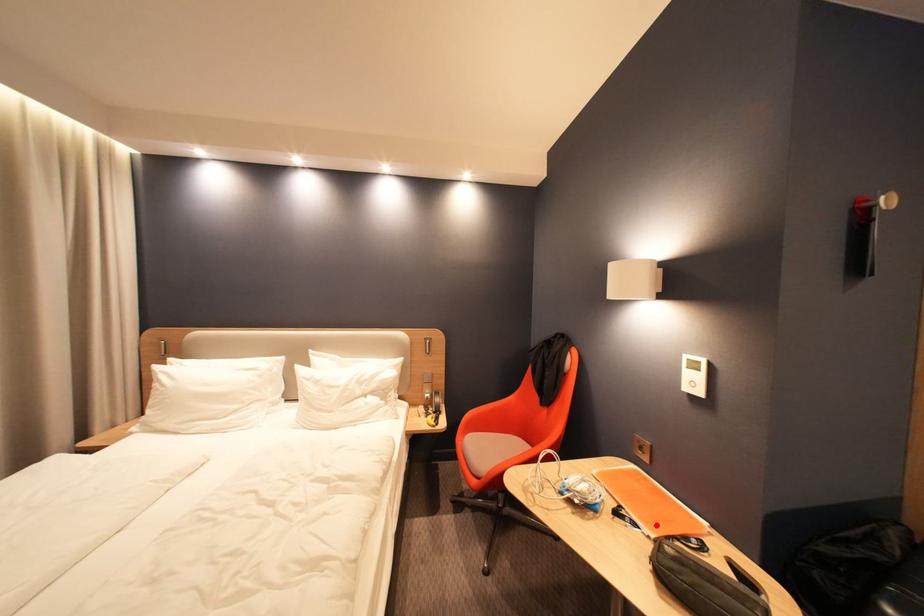
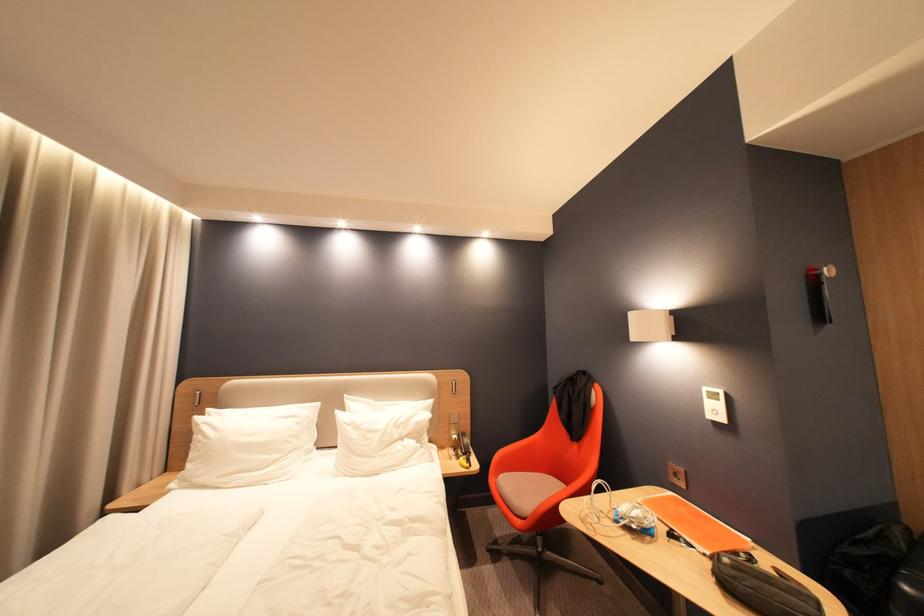
In the second image, find the point that corresponds to the highlighted location in the first image.

(710, 544)